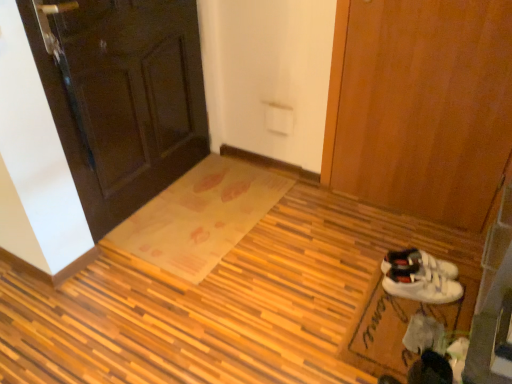
Image resolution: width=512 pixels, height=384 pixels. In order to click on vacant area that lies between white fabric doormat at lower right, which ranks as the second doormat in back-to-front order, and translucent plastic doormat at center, placed as the second doormat when sorted from right to left in this screenshot , I will do `click(309, 268)`.